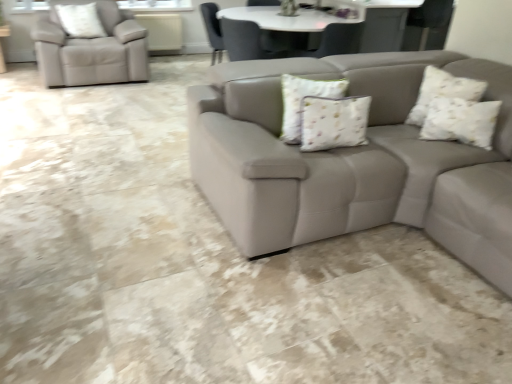
Question: Do you think white textured pillow at upper right, which appears as the second pillow when viewed from the top, is within white textured pillow at upper left, marked as the first pillow in a left-to-right arrangement, or outside of it?

Choices:
 (A) inside
 (B) outside

Answer: (B)

Question: From a real-world perspective, is white textured pillow at upper right, positioned as the 2th pillow in back-to-front order, physically located above or below white textured pillow at upper left, the 3th pillow ordered from the bottom?

Choices:
 (A) above
 (B) below

Answer: (B)

Question: Which is farther from the white floral fabric pillow at center, which is counted as the first pillow, starting from the bottom?

Choices:
 (A) white textured pillow at upper left, marked as the first pillow in a left-to-right arrangement
 (B) white textured pillow at upper right, which is the first pillow from right to left

Answer: (A)

Question: Based on their relative distances, which object is farther from the white textured pillow at upper right, which is the 3th pillow in left-to-right order?

Choices:
 (A) white floral fabric pillow at center, which is counted as the first pillow, starting from the bottom
 (B) white textured pillow at upper left, marked as the first pillow in a left-to-right arrangement

Answer: (B)